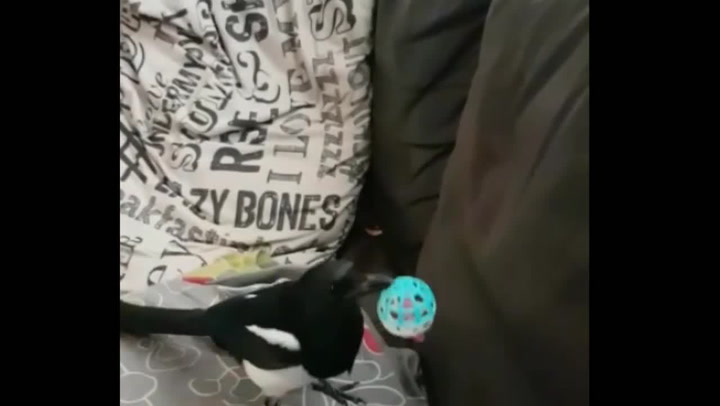
I want to click on gray couch cushion, so click(502, 242).